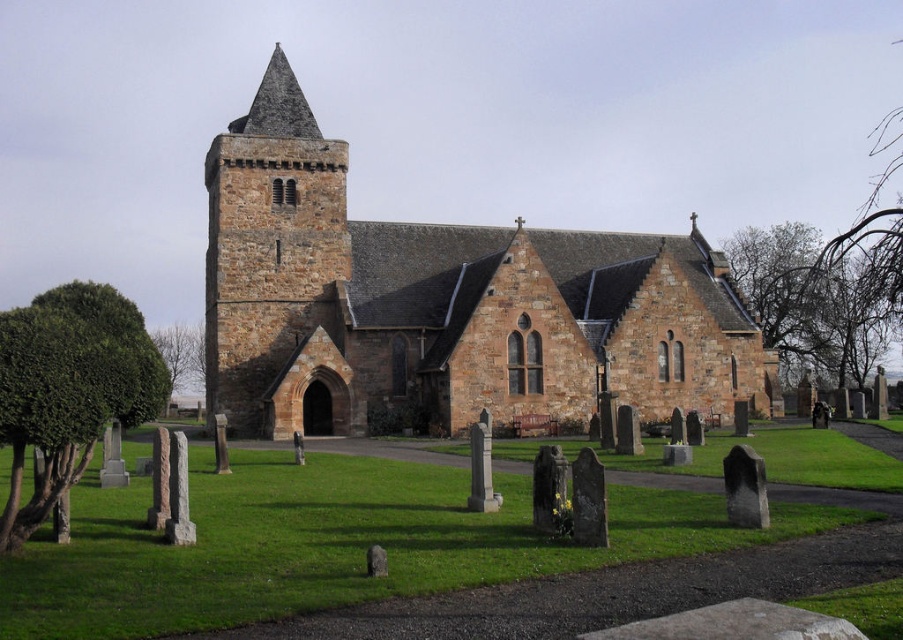
Question: Considering the real-world distances, which object is farthest from the green leafy bush at lower left?

Choices:
 (A) bare branches at upper right
 (B) brown stone church at center

Answer: (A)

Question: Which of these objects is positioned closest to the brown stone church at center?

Choices:
 (A) rustic stone tower at center-left
 (B) green leafy tree at lower left
 (C) green leafy bush at lower left
 (D) bare branches at upper right

Answer: (A)

Question: Can you confirm if brown stone church at center is smaller than green leafy tree at lower left?

Choices:
 (A) no
 (B) yes

Answer: (A)

Question: Where is rustic stone tower at center-left located in relation to green leafy tree at lower left in the image?

Choices:
 (A) below
 (B) above

Answer: (B)

Question: Which point is farther from the camera taking this photo?

Choices:
 (A) (1, 340)
 (B) (290, 355)

Answer: (B)

Question: Does brown stone church at center appear on the right side of green leafy bush at lower left?

Choices:
 (A) yes
 (B) no

Answer: (A)